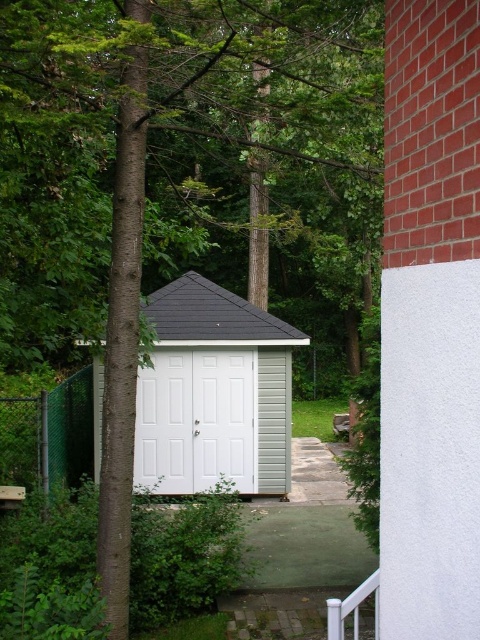
What do you see at coordinates (214, 390) in the screenshot? Image resolution: width=480 pixels, height=640 pixels. I see `white siding shed at center` at bounding box center [214, 390].

Is point (157, 296) positioned after point (355, 634)?

Yes, point (157, 296) is behind point (355, 634).

Locate an element on the screen. This screenshot has height=640, width=480. white siding shed at center is located at coordinates (214, 390).